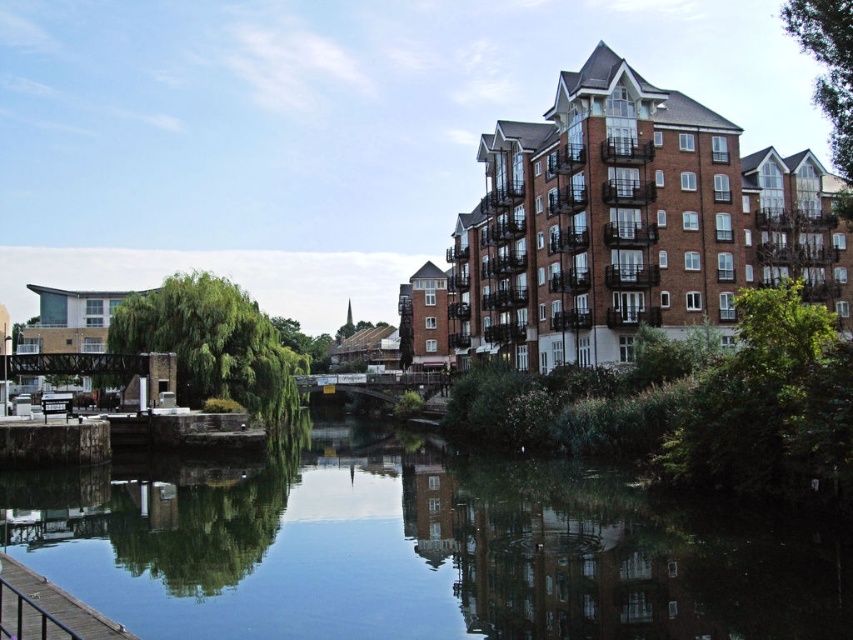
Question: Can you confirm if smooth reflective water at center is positioned above brown wooden dock at lower left?

Choices:
 (A) yes
 (B) no

Answer: (A)

Question: Which point is farther to the camera?

Choices:
 (A) (845, 541)
 (B) (62, 625)

Answer: (A)

Question: Is smooth reflective water at center bigger than brown wooden dock at lower left?

Choices:
 (A) no
 (B) yes

Answer: (B)

Question: Which of the following is the closest to the observer?

Choices:
 (A) brown wooden dock at lower left
 (B) smooth reflective water at center

Answer: (A)

Question: Which point is farther from the camera taking this photo?

Choices:
 (A) (39, 608)
 (B) (54, 484)

Answer: (B)

Question: Is smooth reflective water at center smaller than brown wooden dock at lower left?

Choices:
 (A) yes
 (B) no

Answer: (B)